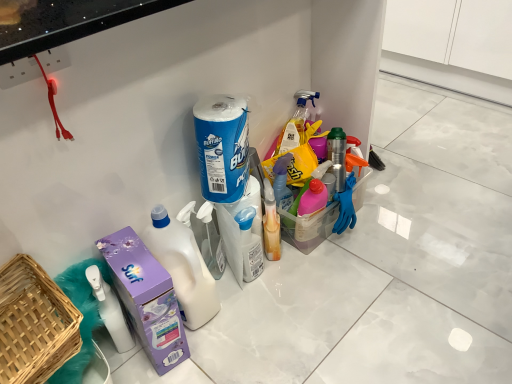
Locate an element on the screen. vacant region above purple cardboard carton at lower left (from a real-world perspective) is located at coordinates (128, 257).